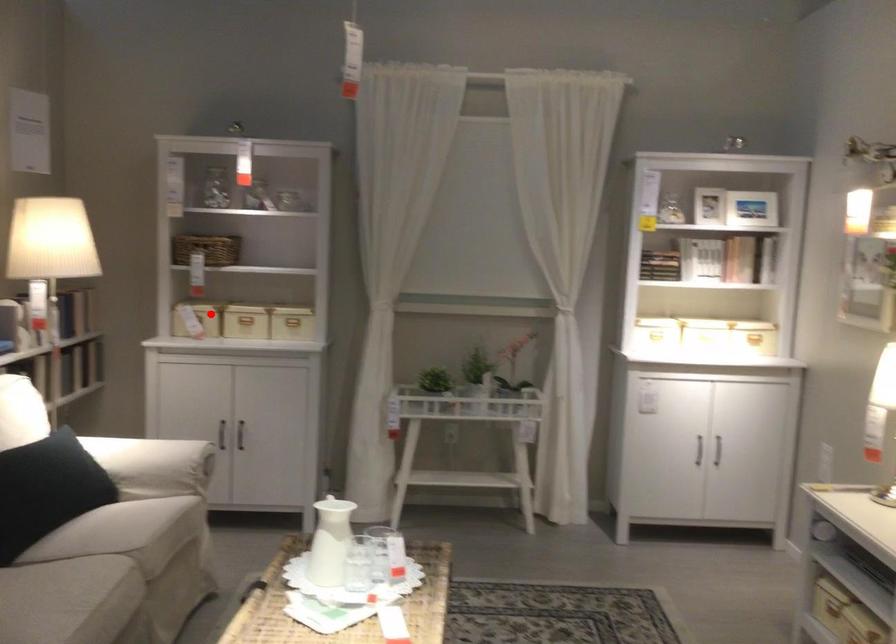
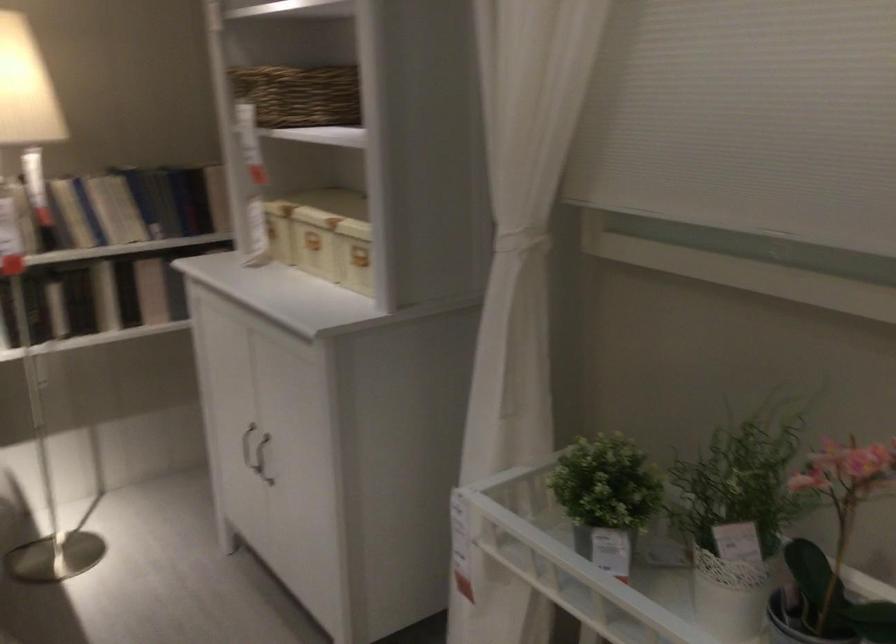
In the second image, find the point that corresponds to the highlighted location in the first image.

(270, 230)